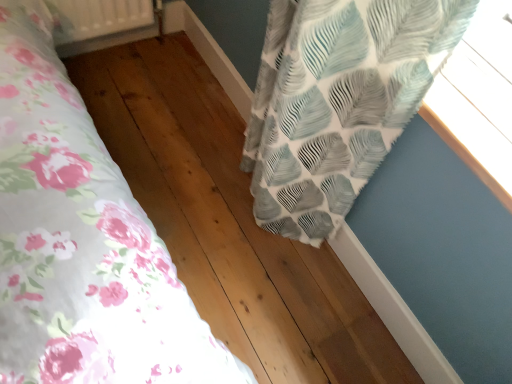
Image resolution: width=512 pixels, height=384 pixels. I want to click on free location to the left of textured white and blue leaf-patterned curtain at upper right, so click(x=186, y=142).